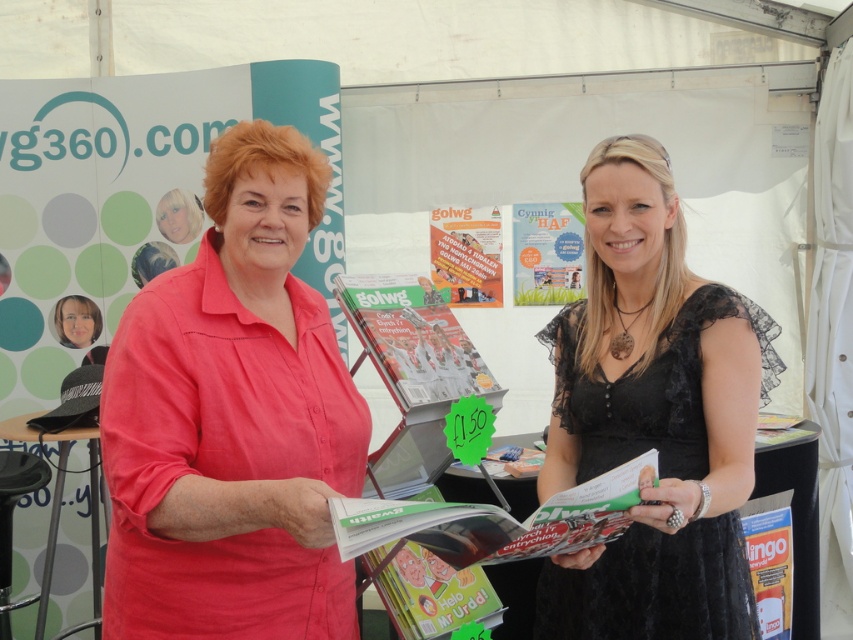
Does pink cotton shirt at center appear on the left side of black lace dress at center?

Indeed, pink cotton shirt at center is positioned on the left side of black lace dress at center.

Is point (254, 333) farther from viewer compared to point (763, 333)?

No, it is not.

You are a GUI agent. You are given a task and a screenshot of the screen. Output one action in this format:
    pyautogui.click(x=<x>, y=<y>)
    Task: Click on the pink cotton shirt at center
    This screenshot has height=640, width=853.
    Given the screenshot: What is the action you would take?
    pyautogui.click(x=233, y=419)